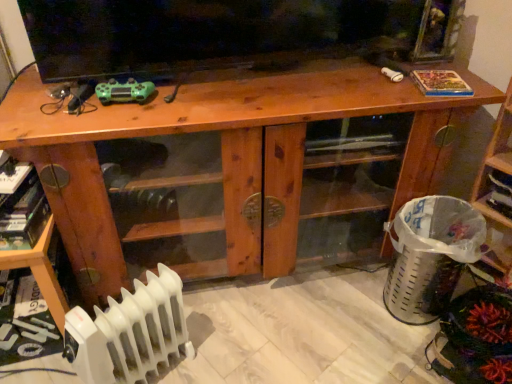
Where is `empty space that is in between matte black tv at upper center and green matte controller at upper left`? The image size is (512, 384). empty space that is in between matte black tv at upper center and green matte controller at upper left is located at coordinates (237, 87).